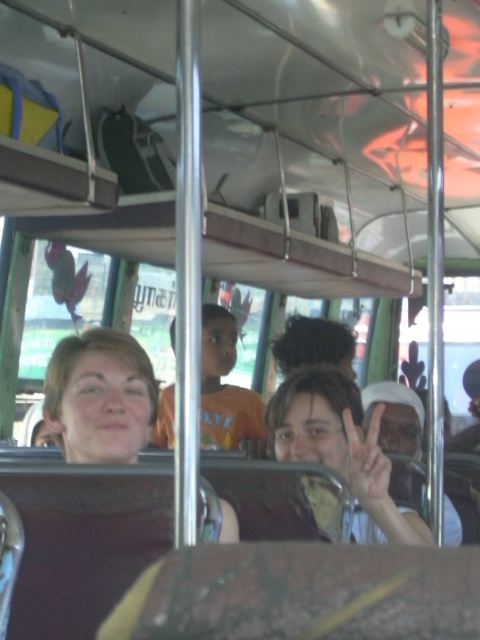
Does point (168, 442) lie in front of point (376, 497)?

No, it is behind (376, 497).

In the scene shown: Is orange t-shirt at center to the left of matte skin hand at center from the viewer's perspective?

Correct, you'll find orange t-shirt at center to the left of matte skin hand at center.

Locate an element on the screen. The image size is (480, 640). orange t-shirt at center is located at coordinates (225, 387).

Where is `orange t-shirt at center`? orange t-shirt at center is located at coordinates (225, 387).